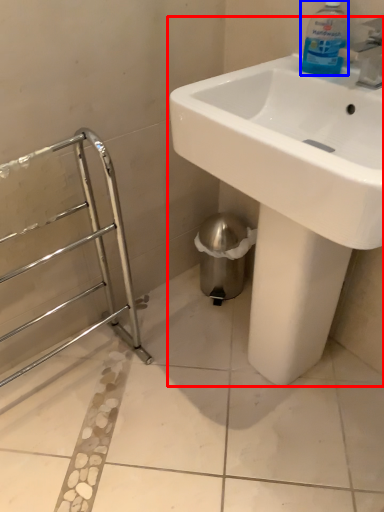
Question: Which object appears farthest to the camera in this image, sink (highlighted by a red box) or cleaning product (highlighted by a blue box)?

Choices:
 (A) sink
 (B) cleaning product

Answer: (B)